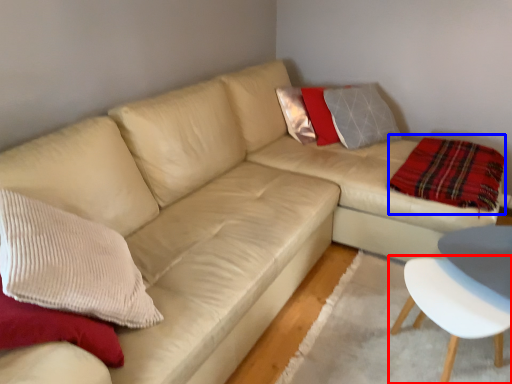
Question: Among these objects, which one is farthest to the camera, chair (highlighted by a red box) or plaid (highlighted by a blue box)?

Choices:
 (A) chair
 (B) plaid

Answer: (B)